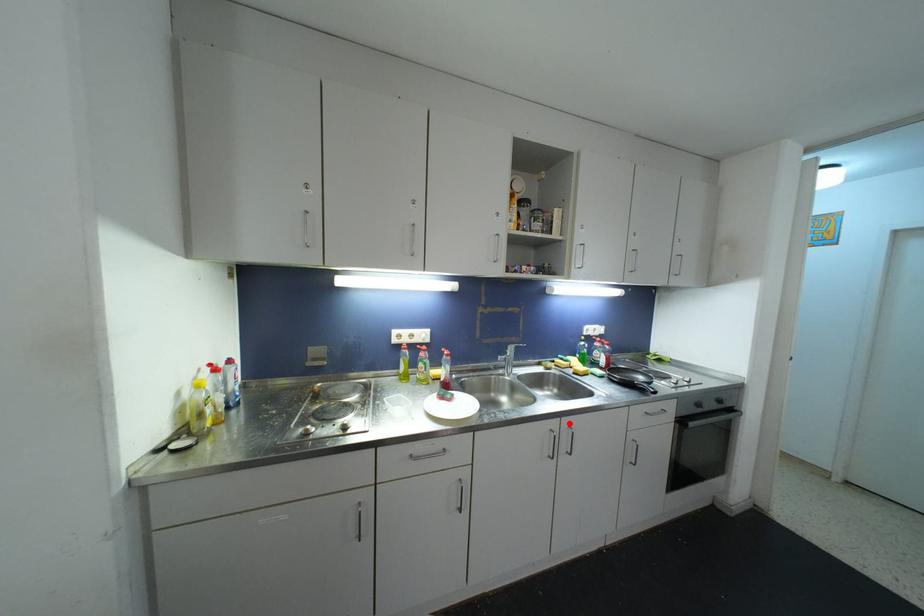
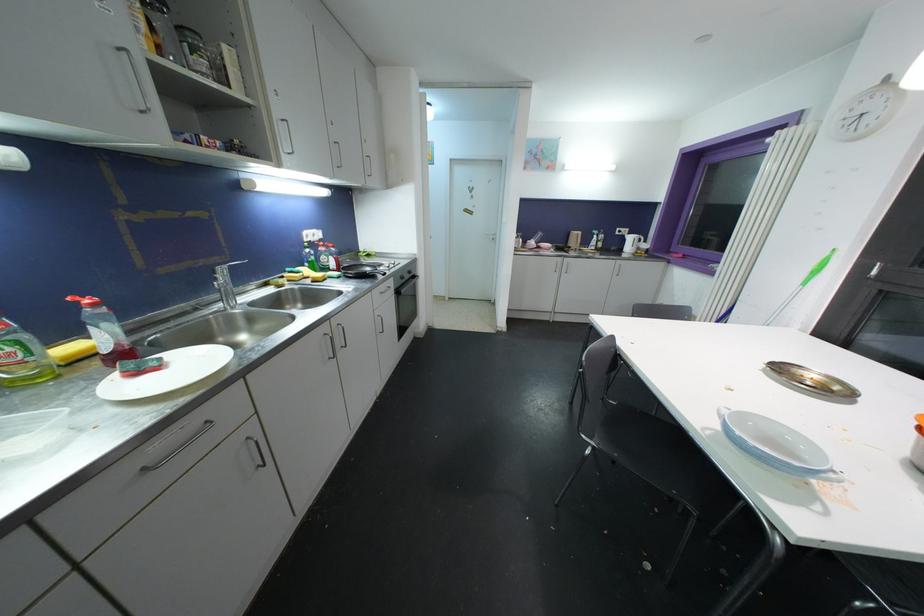
Question: A red point is marked in image1. In image2, is the corresponding 3D point closer to the camera or farther? Reply with the corresponding letter.

Choices:
 (A) The corresponding 3D point is closer.
 (B) The corresponding 3D point is farther.

Answer: (A)